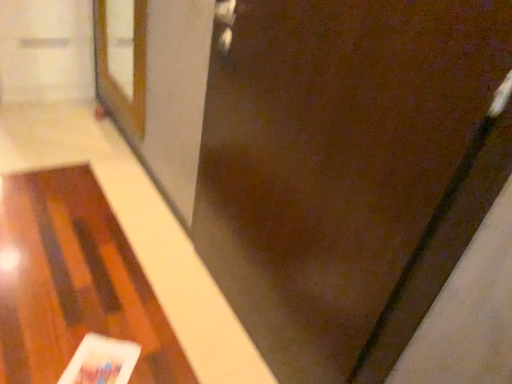
Identify the location of vacant space situated above wooden table at lower left (from a real-world perspective). (72, 289).